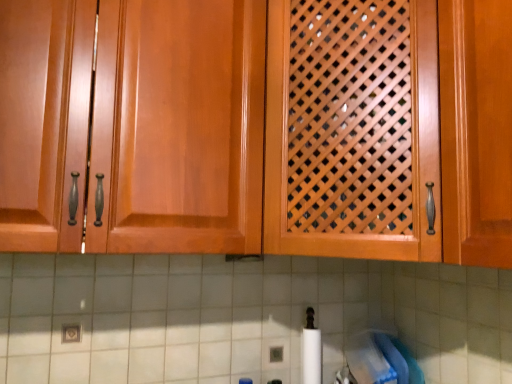
Question: Considering their positions, is wooden lattice door at center, arranged as the second cabinetry when viewed from the left, located in front of or behind glossy wood cabinet at center, which ranks as the first cabinetry in left-to-right order?

Choices:
 (A) behind
 (B) front

Answer: (A)

Question: Looking at their shapes, would you say wooden lattice door at center, the first cabinetry positioned from the right, is wider or thinner than glossy wood cabinet at center, which ranks as the first cabinetry in left-to-right order?

Choices:
 (A) wide
 (B) thin

Answer: (A)

Question: Estimate the real-world distances between objects in this image. Which object is closer to the white tile at lower center?

Choices:
 (A) wooden lattice door at center, the first cabinetry positioned from the right
 (B) glossy wood cabinet at center, the second cabinetry viewed from the right

Answer: (A)

Question: Which is nearer to the wooden lattice door at center, the first cabinetry positioned from the right?

Choices:
 (A) white tile at lower center
 (B) glossy wood cabinet at center, which ranks as the first cabinetry in left-to-right order

Answer: (B)